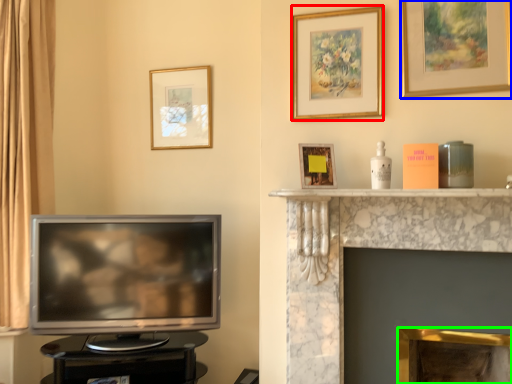
Question: Which object is the closest to the picture frame (highlighted by a red box)? Choose among these: picture frame (highlighted by a blue box) or fireplace (highlighted by a green box).

Choices:
 (A) picture frame
 (B) fireplace

Answer: (A)